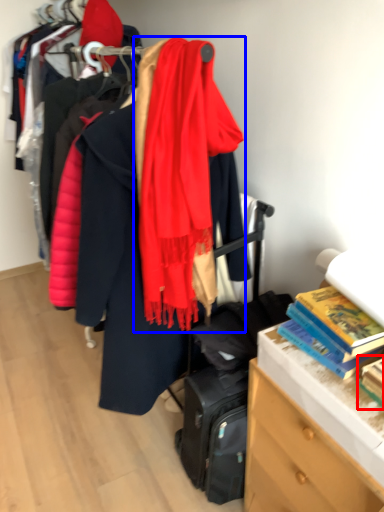
Question: Which of the following is the farthest to the observer, book (highlighted by a red box) or scarf (highlighted by a blue box)?

Choices:
 (A) book
 (B) scarf

Answer: (B)